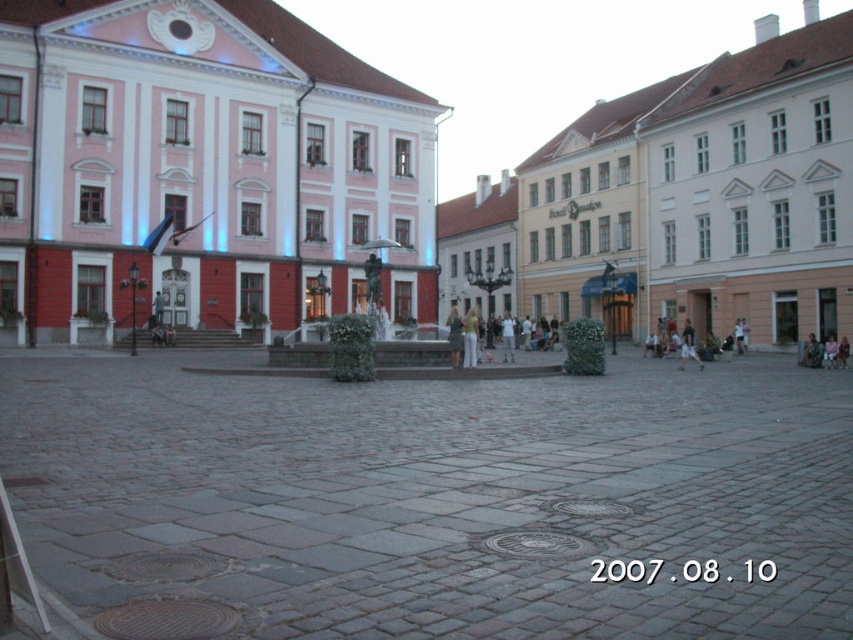
Question: Is the position of gray stone pavement at center less distant than that of white cotton shirt at center?

Choices:
 (A) yes
 (B) no

Answer: (A)

Question: Which object appears closest to the camera in this image?

Choices:
 (A) white cotton shirt at center
 (B) pink stone building at center

Answer: (A)

Question: From the image, what is the correct spatial relationship of gray stone pavement at center in relation to white cotton shirt at center?

Choices:
 (A) above
 (B) below

Answer: (B)

Question: Does pink stone building at center have a lesser width compared to white cotton shirt at center?

Choices:
 (A) yes
 (B) no

Answer: (B)

Question: Among these points, which one is farthest from the camera?

Choices:
 (A) (259, 602)
 (B) (68, 72)

Answer: (B)

Question: Among these objects, which one is nearest to the camera?

Choices:
 (A) gray stone pavement at center
 (B) pink stone building at center
 (C) white cotton shirt at center

Answer: (A)